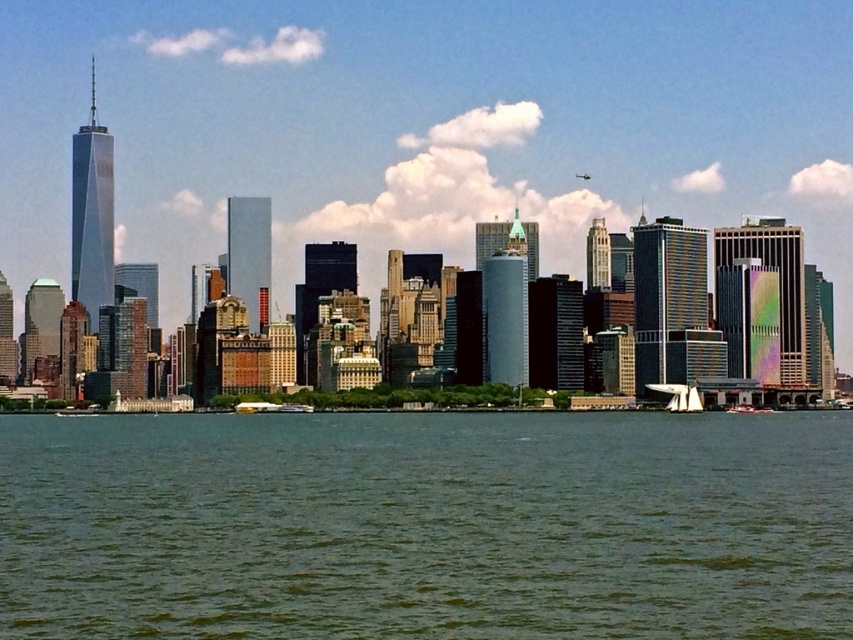
You are a photographer planning to take a picture of the city skyline. You have a camera that can only focus on objects larger than the yellow plastic boat at lower center. Will the green water at lower center be in focus?

The green water at lower center is larger in size than the yellow plastic boat at lower center, so it will be in focus.

You are a photographer planning to capture the city skyline from the water. You have a yellow plastic boat at lower center and a white plastic sailboat at lower right available. Which boat should you choose if you want to fit more equipment on board?

The yellow plastic boat at lower center has a greater width than the white plastic sailboat at lower right, so it can accommodate more equipment.

You are standing on a dock overlooking the city skyline. You see the green water at lower center and the white plastic sailboat at lower right. Which object appears taller in the image?

The green water at lower center appears taller than the white plastic sailboat at lower right in the image.